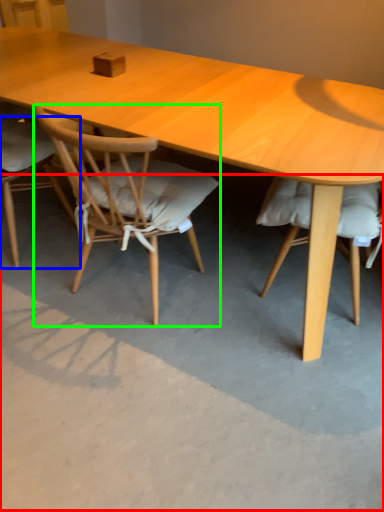
Question: Which object is the closest to the concrete (highlighted by a red box)? Choose among these: chair (highlighted by a blue box) or chair (highlighted by a green box).

Choices:
 (A) chair
 (B) chair

Answer: (B)